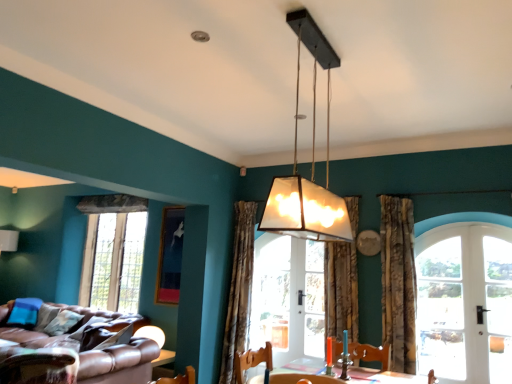
Question: Considering the positions of textured beige curtain at center, which ranks as the second curtain in right-to-left order, and floral fabric curtain at right, which is counted as the 1th curtain, starting from the right, in the image, is textured beige curtain at center, which ranks as the second curtain in right-to-left order, wider or thinner than floral fabric curtain at right, which is counted as the 1th curtain, starting from the right,?

Choices:
 (A) thin
 (B) wide

Answer: (A)

Question: In terms of height, does textured beige curtain at center, the 2th curtain from the left, look taller or shorter compared to floral fabric curtain at right, which is counted as the 1th curtain, starting from the right?

Choices:
 (A) short
 (B) tall

Answer: (A)

Question: Estimate the real-world distances between objects in this image. Which object is farther from the wooden swivel chair at lower center, the first swivel chair in the right-to-left sequence?

Choices:
 (A) floral fabric curtain at right, acting as the 3th curtain starting from the left
 (B) clear glass door at right
 (C) patterned fabric curtain at center, placed as the 1th curtain when sorted from left to right
 (D) white glass door at right, which is counted as the second window, starting from the back
 (E) leather swivel chair at lower left, which ranks as the first swivel chair in left-to-right order

Answer: (E)

Question: Estimate the real-world distances between objects in this image. Which object is closer to the brown leather couch at lower left?

Choices:
 (A) matte glass lampshade at center
 (B) white glass door at right, positioned as the first window in right-to-left order
 (C) textured beige curtain at center, the 2th curtain from the left
 (D) wooden swivel chair at lower center, which ranks as the second swivel chair in left-to-right order
 (E) leather swivel chair at lower left, acting as the 2th swivel chair starting from the right

Answer: (E)